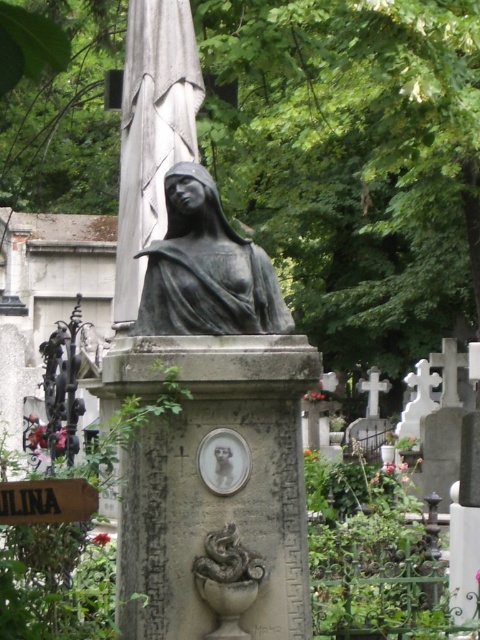
Is point (168, 304) closer to camera compared to point (26, 518)?

That is False.

You are a GUI agent. You are given a task and a screenshot of the screen. Output one action in this format:
    pyautogui.click(x=<x>, y=<y>)
    Task: Click on the bronze statue at center
    The image size is (480, 640).
    Given the screenshot: What is the action you would take?
    pyautogui.click(x=205, y=269)

Find the location of a particular element. The image size is (480, 640). bronze statue at center is located at coordinates (205, 269).